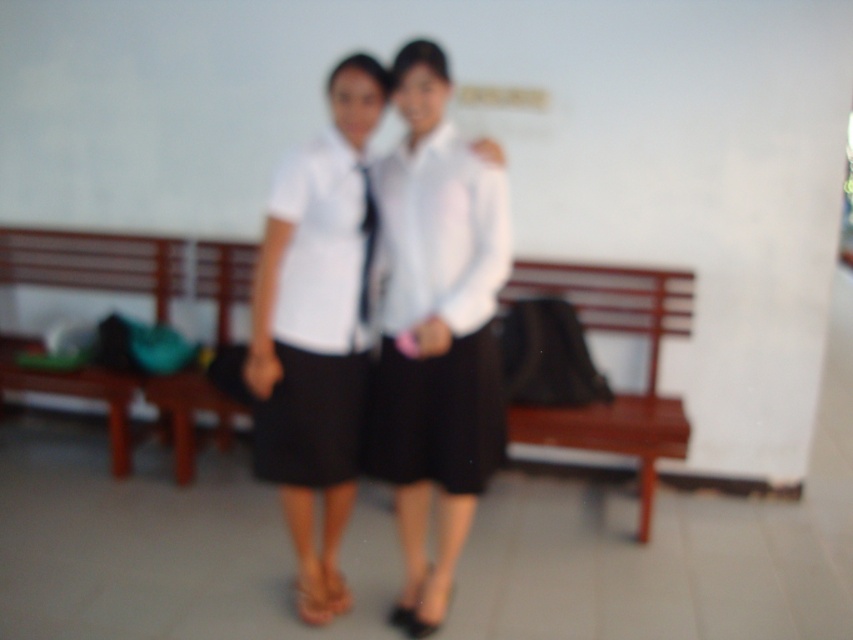
Question: Is white matte shirt at center thinner than white matte uniform skirt at center?

Choices:
 (A) yes
 (B) no

Answer: (B)

Question: Is white matte uniform skirt at center smaller than white smooth shirt at center?

Choices:
 (A) no
 (B) yes

Answer: (B)

Question: Which of these objects is positioned farthest from the black satin tie at center?

Choices:
 (A) wooden bench at center
 (B) white smooth shirt at center
 (C) white matte uniform skirt at center
 (D) white matte shirt at center

Answer: (A)

Question: Which point appears farthest from the camera in this image?

Choices:
 (A) (187, 452)
 (B) (312, 477)
 (C) (380, 108)

Answer: (A)

Question: Estimate the real-world distances between objects in this image. Which object is farther from the white smooth shirt at center?

Choices:
 (A) wooden bench at center
 (B) black satin tie at center
 (C) white matte shirt at center

Answer: (A)

Question: Does white matte uniform skirt at center have a lesser width compared to white smooth shirt at center?

Choices:
 (A) yes
 (B) no

Answer: (A)